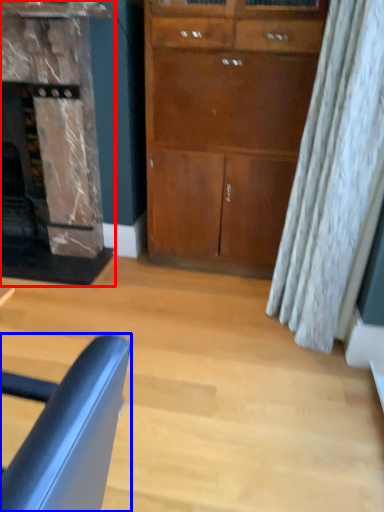
Question: Which object is further to the camera taking this photo, fireplace (highlighted by a red box) or chair (highlighted by a blue box)?

Choices:
 (A) fireplace
 (B) chair

Answer: (A)